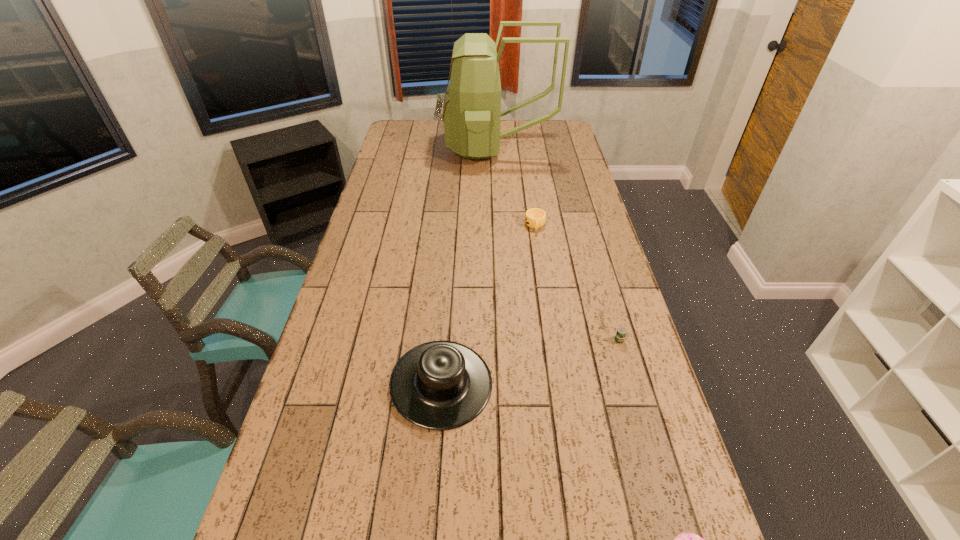
Find the location of a particular element. The width and height of the screenshot is (960, 540). vacant space at the far right corner of the desktop is located at coordinates click(x=556, y=125).

I want to click on free area in between the tallest object and the second farthest object, so click(x=516, y=187).

The width and height of the screenshot is (960, 540). Identify the location of free space between the dress hat and the second farthest object. (489, 305).

Where is `vacant area between the fourth nearest object and the beer can`? vacant area between the fourth nearest object and the beer can is located at coordinates (577, 283).

Locate an element on the screen. This screenshot has width=960, height=540. unoccupied position between the beer can and the cup is located at coordinates (577, 283).

Where is `free space between the beer can and the farthest object`? free space between the beer can and the farthest object is located at coordinates (559, 244).

The height and width of the screenshot is (540, 960). Find the location of `object that stands as the closest to the farthest object`. object that stands as the closest to the farthest object is located at coordinates (535, 218).

Where is `object that can be found as the second closest to the doughnut`? object that can be found as the second closest to the doughnut is located at coordinates 620,335.

The image size is (960, 540). Identify the location of free space that satisfies the following two spatial constraints: 1. on the back side of the cup; 2. on the front pocket of the tallest object. (523, 148).

The height and width of the screenshot is (540, 960). I want to click on vacant point that satisfies the following two spatial constraints: 1. on the front pocket of the second farthest object; 2. on the left side of the tallest object, so click(x=503, y=226).